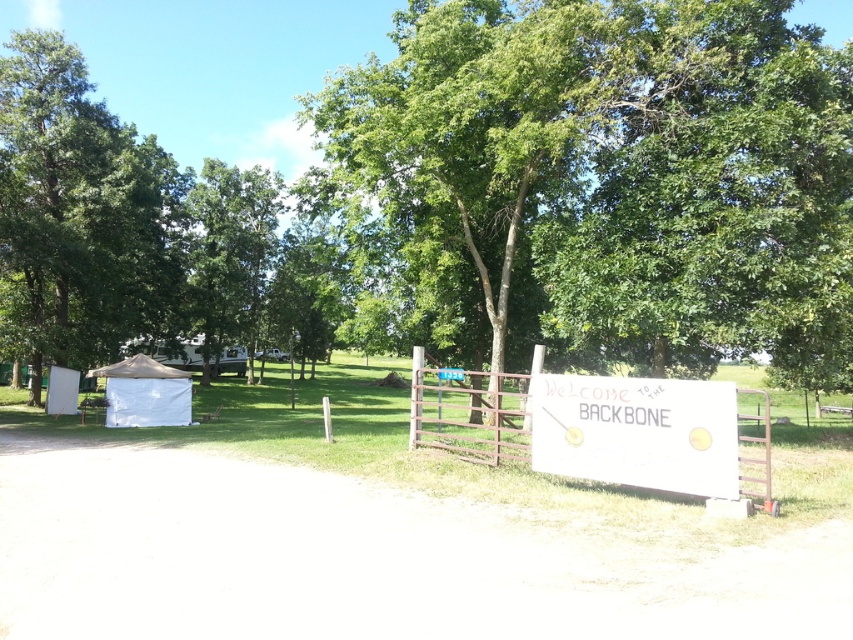
You are a visitor arriving at the Backbone area and need to set up your equipment near the metallic silver gate at center. However, there is already a white canvas tent at left nearby. How far apart are these two structures?

The metallic silver gate at center and the white canvas tent at left are 37.45 feet apart from each other.

You are standing on the dirt path and see both the green leafy tree at center and the green leafy tree at left. Which tree is closer to the left side of the image?

The green leafy tree at left is closer to the left side of the image because it is positioned to the left of the green leafy tree at center.

You are standing at the camera position looking at the rural scene. There is a point marked at coordinates point (815, 289). If you walk straight towards this point, how far will you have to walk to reach it?

The distance of point (815, 289) from camera is 45.78 feet, so you will have to walk 45.78 feet to reach it.